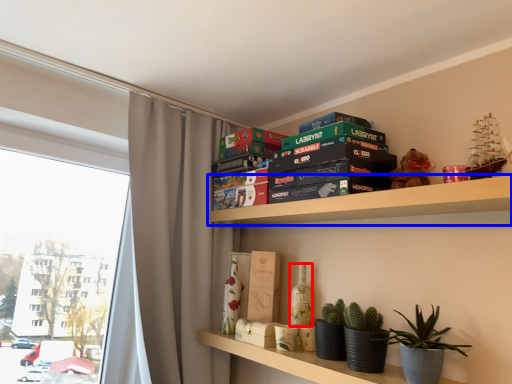
Question: Which point is closer to the camera, bottle (highlighted by a red box) or shelf (highlighted by a blue box)?

Choices:
 (A) bottle
 (B) shelf

Answer: (B)